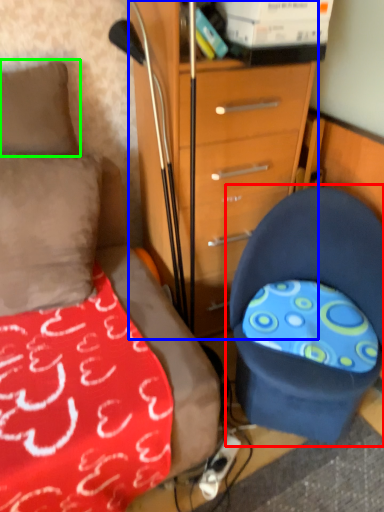
Question: Which is farther away from chair (highlighted by a red box)? chest of drawers (highlighted by a blue box) or pillow (highlighted by a green box)?

Choices:
 (A) chest of drawers
 (B) pillow

Answer: (B)